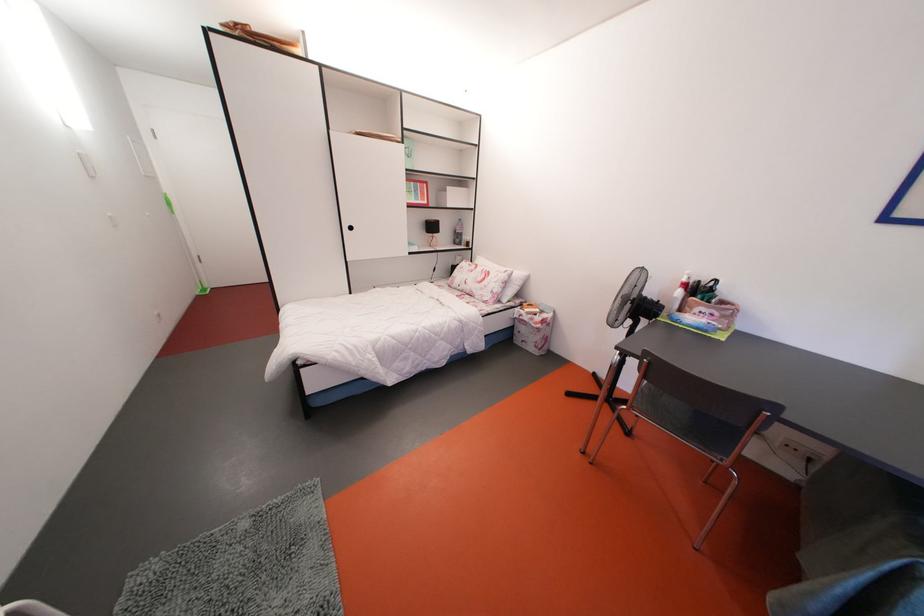
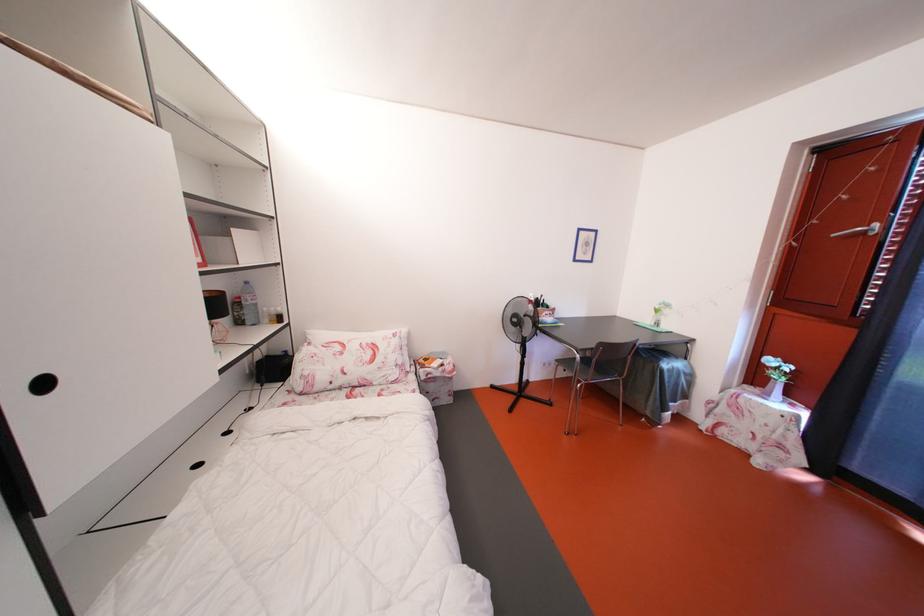
Where in the second image is the point corresponding to [467,225] from the first image?

(253, 288)